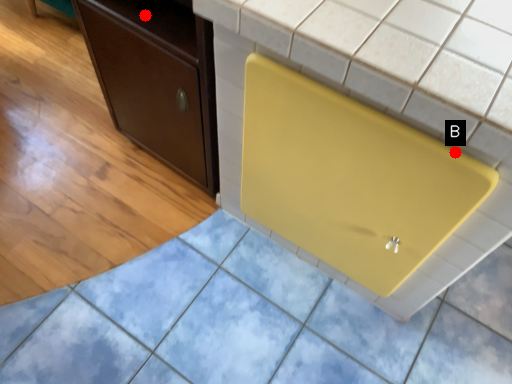
Question: Two points are circled on the image, labeled by A and B beside each circle. Which point appears closest to the camera in this image?

Choices:
 (A) A is closer
 (B) B is closer

Answer: (B)